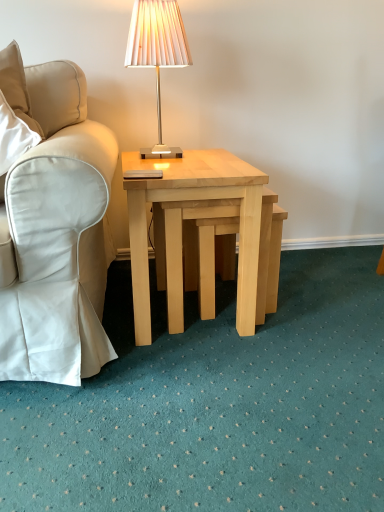
Image resolution: width=384 pixels, height=512 pixels. Identify the location of free space on the front side of light wood/natural wood coffee table at center. (200, 385).